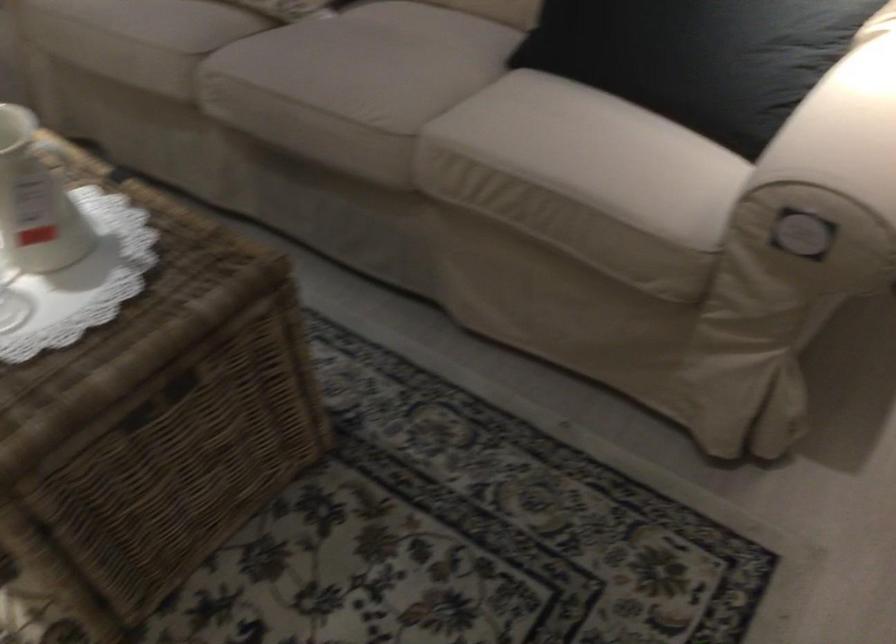
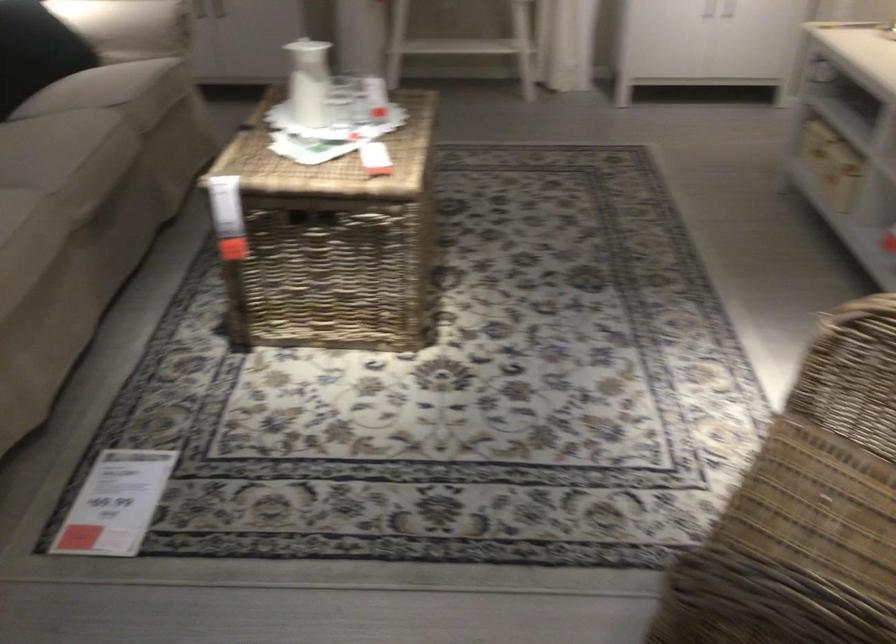
The point at (333, 114) is marked in the first image. Where is the corresponding point in the second image?

(109, 140)